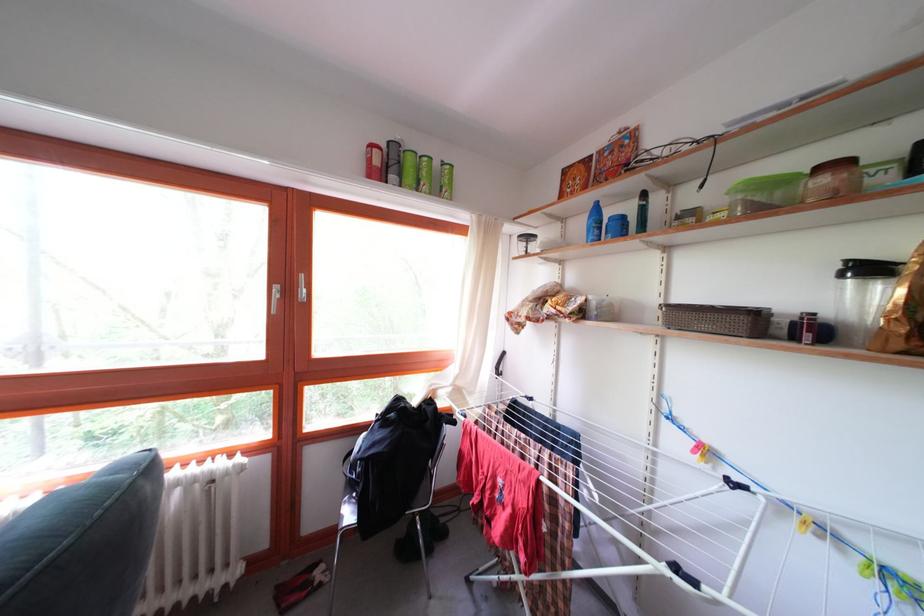
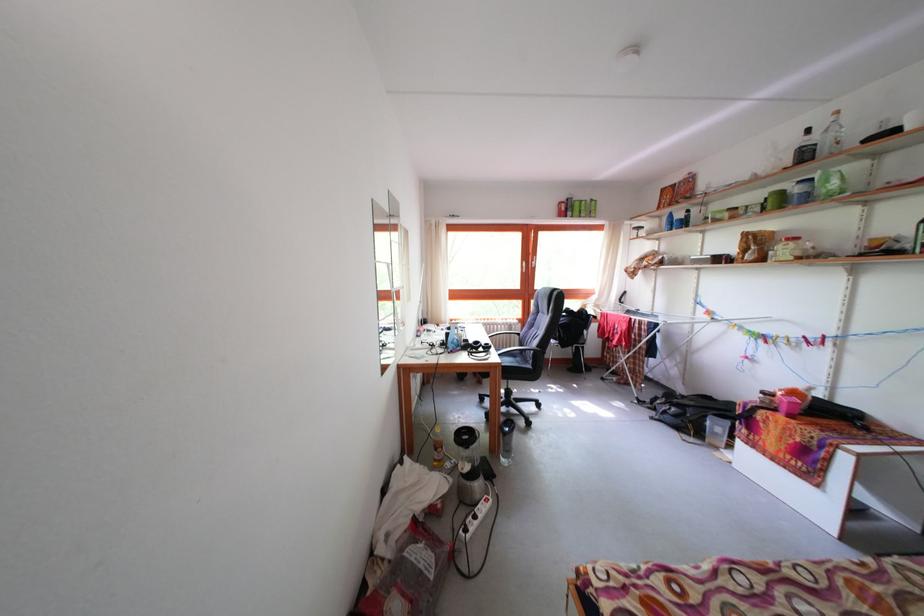
The point at (x=572, y=225) is marked in the first image. Where is the corresponding point in the second image?

(667, 224)